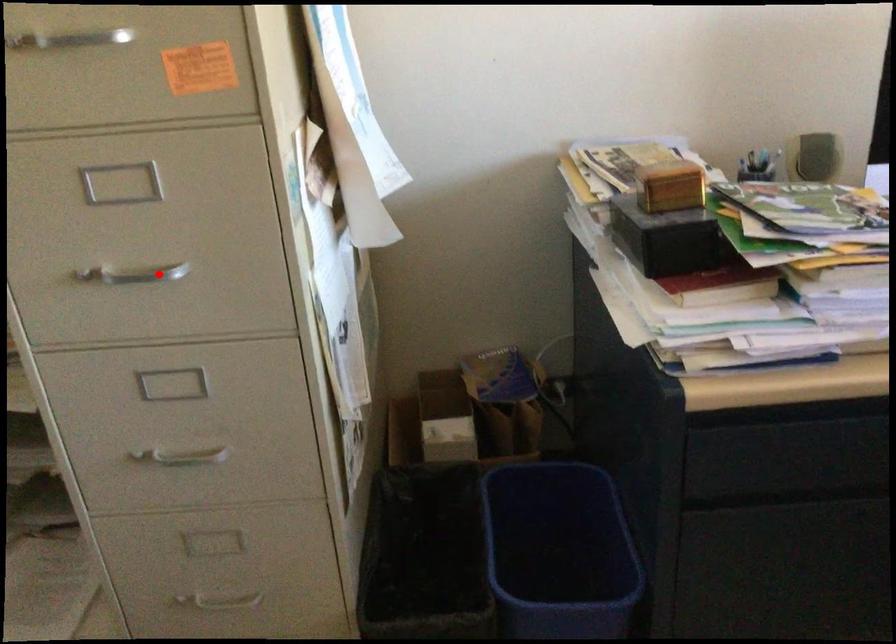
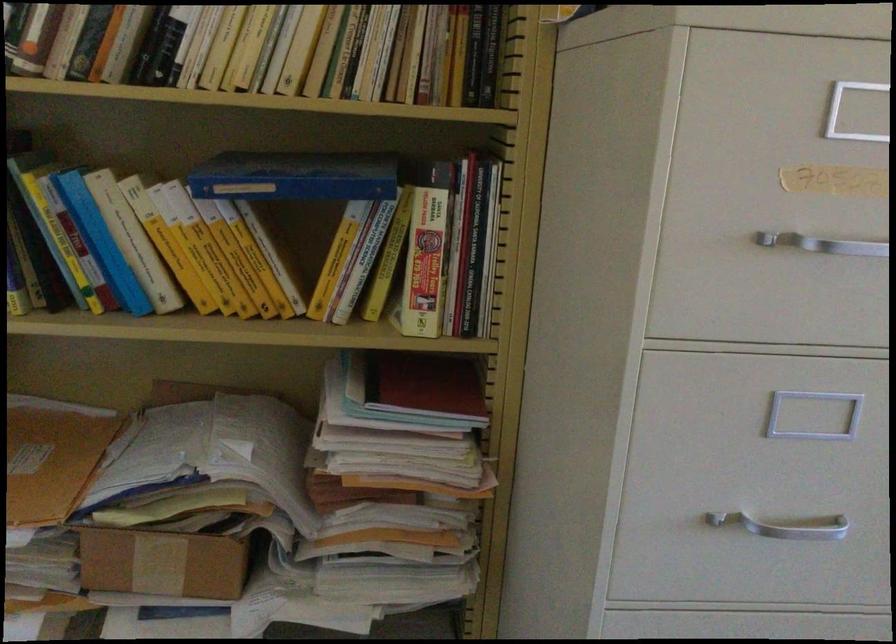
Question: I am providing you with two images of the same scene from different viewpoints. A red point is shown in image1. For the corresponding object point in image2, is it positioned nearer or farther from the camera?

Choices:
 (A) Nearer
 (B) Farther

Answer: (A)